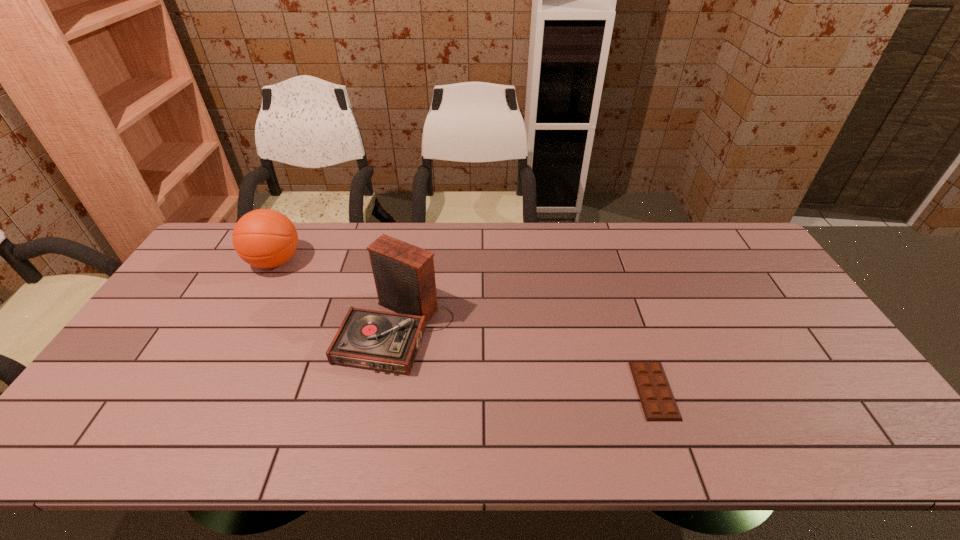
Find the location of a particular element. free location at the far edge of the desktop is located at coordinates pyautogui.click(x=504, y=227).

Locate an element on the screen. The height and width of the screenshot is (540, 960). free space at the near edge of the desktop is located at coordinates (356, 456).

The height and width of the screenshot is (540, 960). In the image, there is a desktop. Identify the location of vacant space at the left edge. (208, 287).

The height and width of the screenshot is (540, 960). Find the location of `free space between the shortest object and the farthest object`. free space between the shortest object and the farthest object is located at coordinates (465, 326).

Locate an element on the screen. Image resolution: width=960 pixels, height=540 pixels. vacant area that lies between the second object from right to left and the farthest object is located at coordinates (336, 295).

Where is `free space between the phonograph record and the shortest object`? Image resolution: width=960 pixels, height=540 pixels. free space between the phonograph record and the shortest object is located at coordinates (525, 360).

You are a GUI agent. You are given a task and a screenshot of the screen. Output one action in this format:
    pyautogui.click(x=<x>, y=<y>)
    Task: Click on the free space between the rightmost object and the second object from right to left
    
    Given the screenshot: What is the action you would take?
    [x=525, y=360]

The image size is (960, 540). Find the location of `free space between the phonograph record and the shortest object`. free space between the phonograph record and the shortest object is located at coordinates (525, 360).

Identify the location of unoccupied position between the rightmost object and the phonograph record. Image resolution: width=960 pixels, height=540 pixels. (525, 360).

This screenshot has width=960, height=540. Find the location of `vacant region between the shortest object and the farthest object`. vacant region between the shortest object and the farthest object is located at coordinates (465, 326).